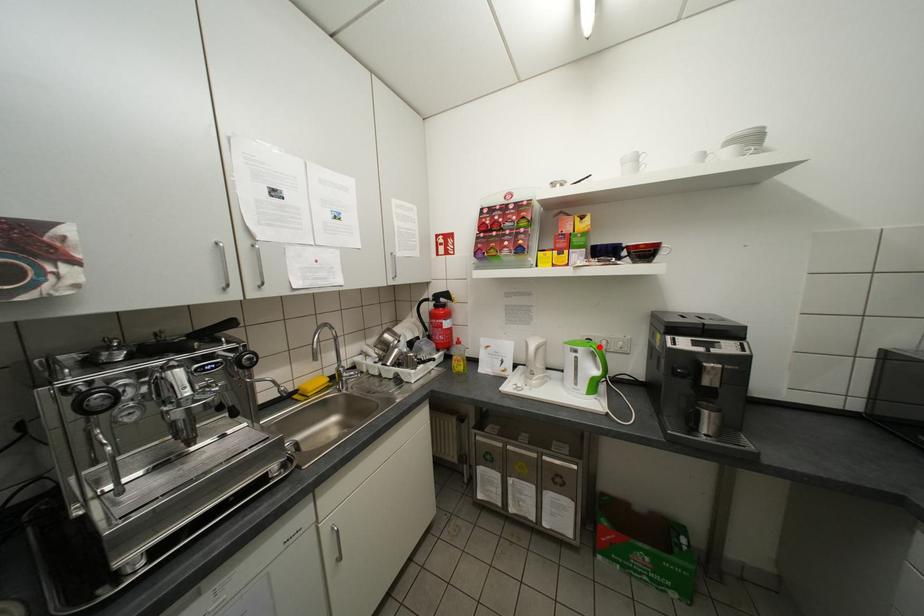
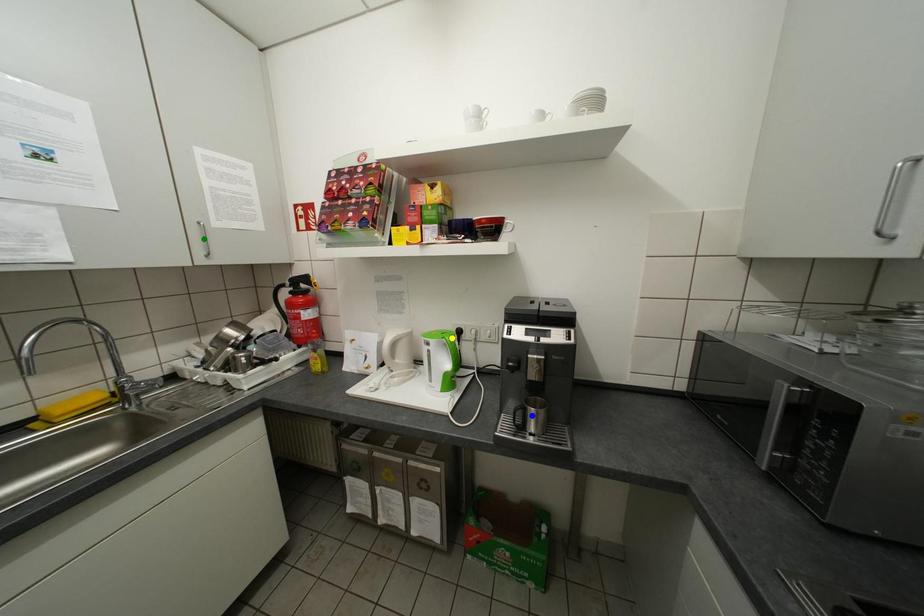
Question: I am providing you with two images of the same scene from different viewpoints. A red point is marked on the first image. You are given multiple points on the second image. Can you choose the point in image 2 that corresponds to the point in image 1?

Choices:
 (A) blue point
 (B) green point
 (C) yellow point

Answer: (C)